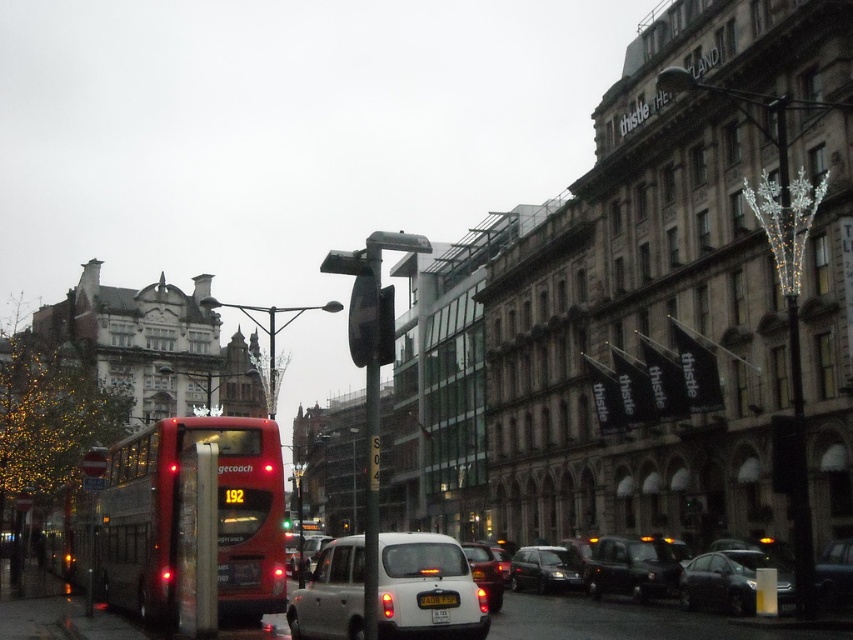
Question: Is white matte taxi at center to the left of black matte taxi at center from the viewer's perspective?

Choices:
 (A) no
 (B) yes

Answer: (B)

Question: Does white matte taxi at center appear on the left side of yellow matte license plate at center?

Choices:
 (A) no
 (B) yes

Answer: (B)

Question: Which object appears farthest from the camera in this image?

Choices:
 (A) metallic silver car at center
 (B) matte red bus at center
 (C) matte white car at center

Answer: (A)

Question: Is metallic silver car at center thinner than yellow matte license plate at center?

Choices:
 (A) yes
 (B) no

Answer: (B)

Question: Which point is farther to the camera?

Choices:
 (A) matte red bus at center
 (B) metallic silver car at center
 (C) white matte taxi at center

Answer: (B)

Question: Which of the following is the farthest from the observer?

Choices:
 (A) metallic silver car at center
 (B) matte white car at center

Answer: (A)